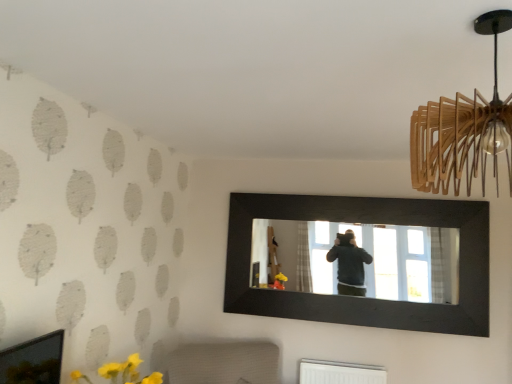
Question: Should I look upward or downward to see black wooden mirror at center?

Choices:
 (A) up
 (B) down

Answer: (B)

Question: Is white textured radiator at lower center positioned far away from black wooden mirror at center?

Choices:
 (A) yes
 (B) no

Answer: (B)

Question: Is white textured radiator at lower center to the left of black wooden mirror at center from the viewer's perspective?

Choices:
 (A) yes
 (B) no

Answer: (A)

Question: From the image's perspective, does white textured radiator at lower center appear higher than black wooden mirror at center?

Choices:
 (A) yes
 (B) no

Answer: (B)

Question: Does white textured radiator at lower center have a lesser width compared to black wooden mirror at center?

Choices:
 (A) yes
 (B) no

Answer: (B)

Question: From a real-world perspective, is white textured radiator at lower center located higher than black wooden mirror at center?

Choices:
 (A) yes
 (B) no

Answer: (B)

Question: Is white textured radiator at lower center not within black wooden mirror at center?

Choices:
 (A) yes
 (B) no

Answer: (A)

Question: Is wooden pendant light at upper right to the right of white textured radiator at lower center from the viewer's perspective?

Choices:
 (A) no
 (B) yes

Answer: (B)

Question: Can you confirm if wooden pendant light at upper right is thinner than white textured radiator at lower center?

Choices:
 (A) yes
 (B) no

Answer: (A)

Question: Can we say wooden pendant light at upper right lies outside white textured radiator at lower center?

Choices:
 (A) no
 (B) yes

Answer: (B)

Question: Is wooden pendant light at upper right wider than white textured radiator at lower center?

Choices:
 (A) yes
 (B) no

Answer: (B)

Question: Can you confirm if wooden pendant light at upper right is shorter than white textured radiator at lower center?

Choices:
 (A) yes
 (B) no

Answer: (B)

Question: From the image's perspective, is wooden pendant light at upper right on white textured radiator at lower center?

Choices:
 (A) yes
 (B) no

Answer: (A)

Question: Does wooden pendant light at upper right have a smaller size compared to black wooden mirror at center?

Choices:
 (A) no
 (B) yes

Answer: (B)